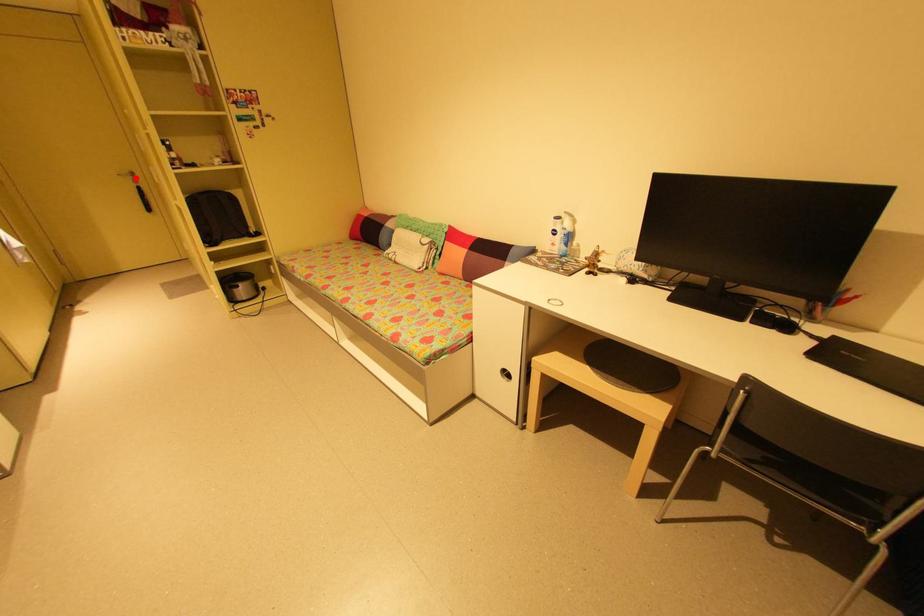
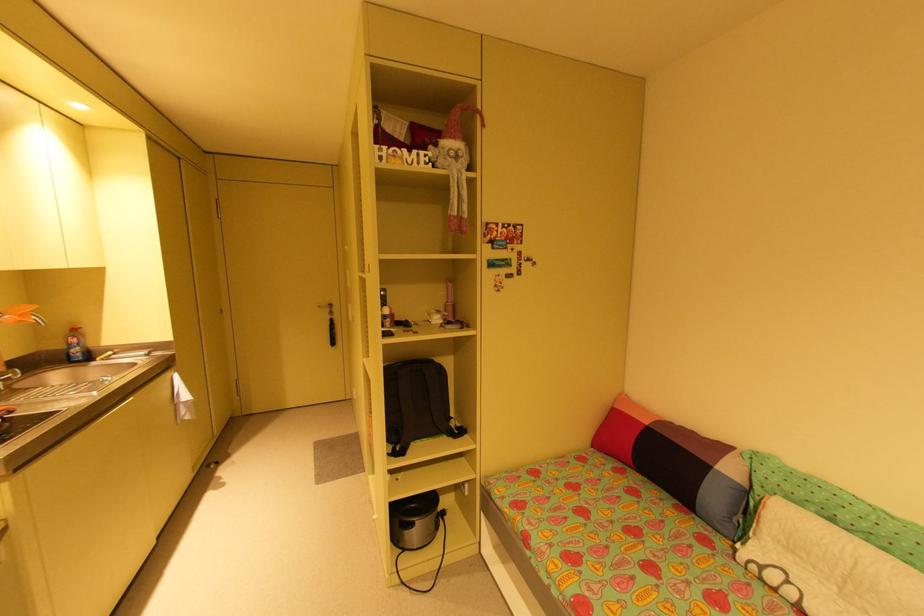
Where in the second image is the point corresponding to the highlighted location from the first image?

(333, 310)